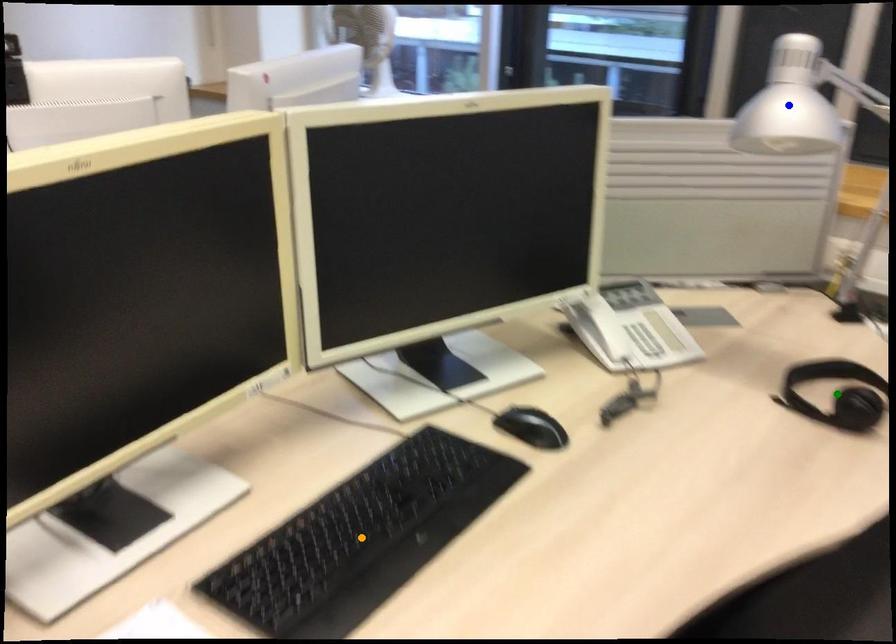
Order these from nearest to farthest:
- green point
- orange point
- blue point

1. orange point
2. green point
3. blue point